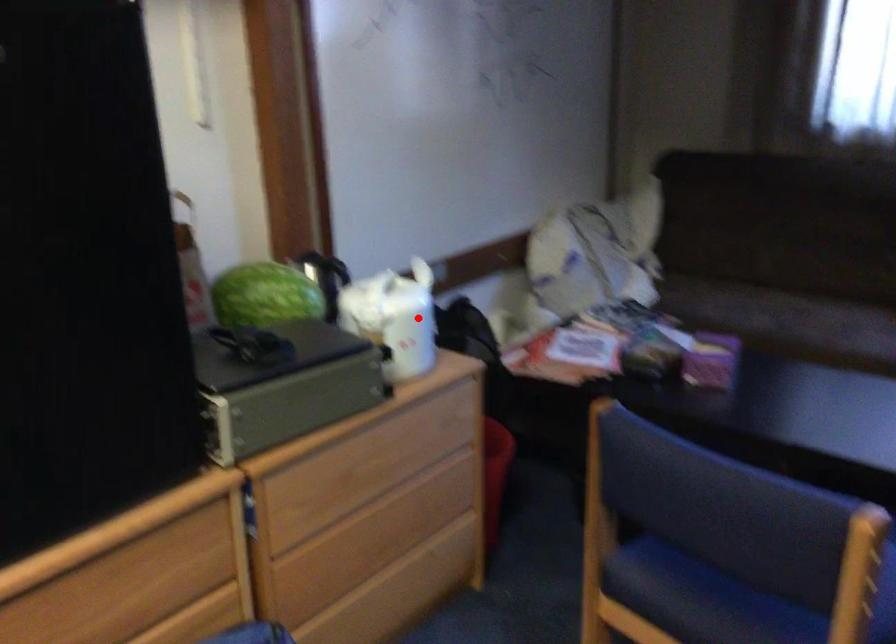
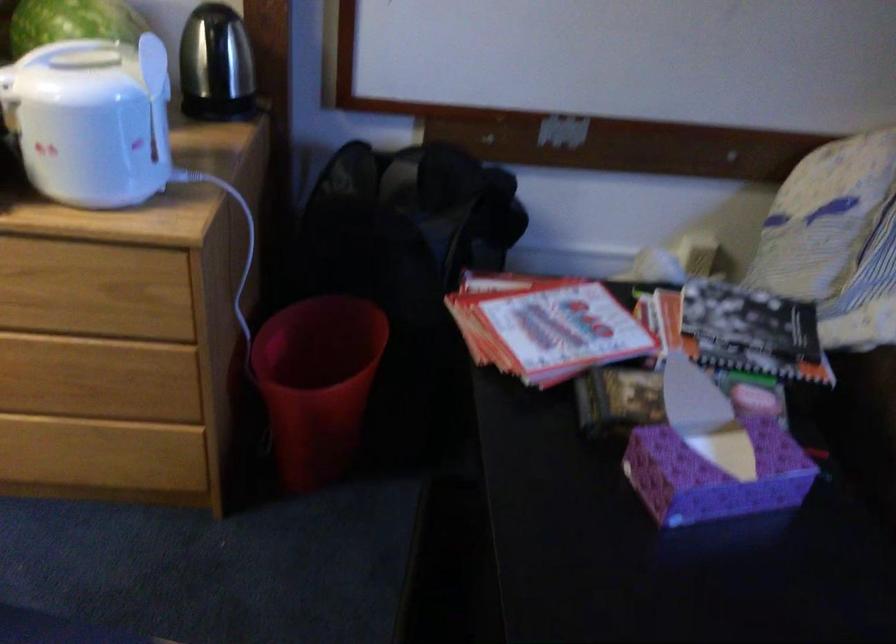
Question: I am providing you with two images of the same scene from different viewpoints. In image1, a red point is highlighted. Considering the same 3D point in image2, which of the following is correct?

Choices:
 (A) It is closer
 (B) It is farther

Answer: (A)